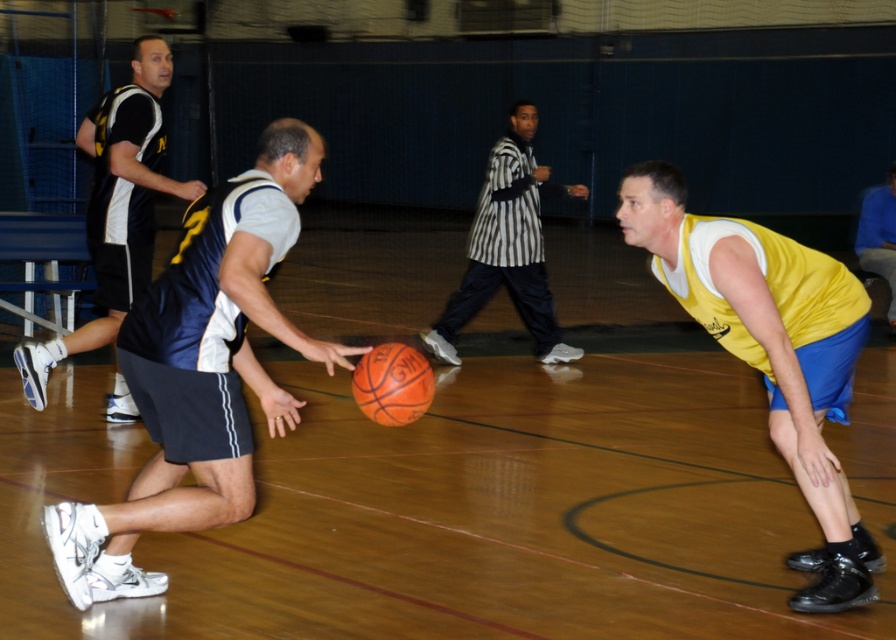
Can you confirm if yellow matte jersey at center is bigger than yellow jersey at right?

Yes.

Does yellow matte jersey at center appear on the right side of yellow jersey at right?

Incorrect, yellow matte jersey at center is not on the right side of yellow jersey at right.

Between point (825, 268) and point (885, 248), which one is positioned in front?

Point (825, 268) is more forward.

Where is `yellow matte jersey at center`? yellow matte jersey at center is located at coordinates (772, 352).

Is point (210, 294) closer to viewer compared to point (886, 266)?

Yes, point (210, 294) is closer to viewer.

Is blue jersey at center in front of yellow jersey at right?

Yes.

Does point (123, 321) come farther from viewer compared to point (860, 220)?

No, it is in front of (860, 220).

This screenshot has height=640, width=896. I want to click on blue jersey at center, so click(200, 371).

Which of these two, orange rubber basketball at center or yellow jersey at right, stands shorter?

Standing shorter between the two is orange rubber basketball at center.

Is orange rubber basketball at center to the right of yellow jersey at right from the viewer's perspective?

Incorrect, orange rubber basketball at center is not on the right side of yellow jersey at right.

Who is more distant from viewer, (x=406, y=403) or (x=879, y=262)?

The point (x=879, y=262) is behind.

At what (x,y) coordinates should I click in order to perform the action: click on orange rubber basketball at center. Please return your answer as a coordinate pair (x, y). The width and height of the screenshot is (896, 640). Looking at the image, I should click on (392, 384).